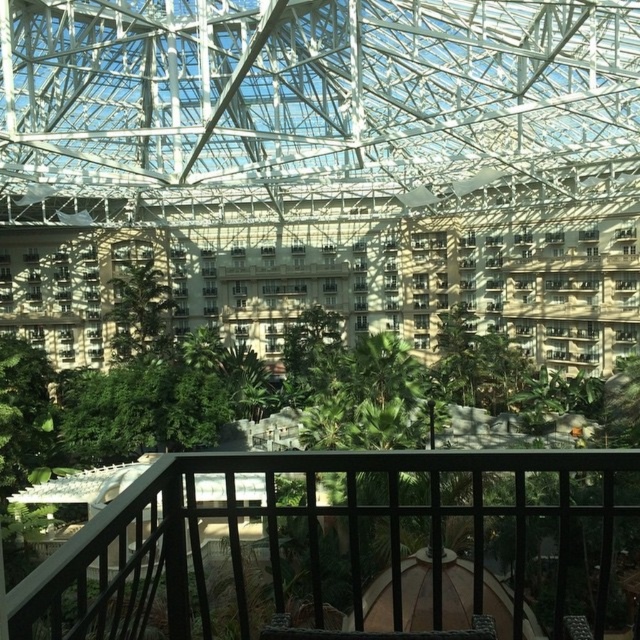
Looking at this image, you are standing in the atrium and want to look up at the glass roof structure. Is the black wood railing at center blocking your view of the beige concrete building at center?

The black wood railing at center is positioned under the beige concrete building at center, so the railing is below the building and would not block your view of the beige concrete building at center.

You are standing in the atrium and want to take a photo of the beige concrete building at center. If your camera can focus on objects up to 40 meters away, will you need to adjust your position to capture it clearly?

The beige concrete building at center is 41.51 meters away from viewer, which is beyond the camera focus range of 40 meters. You need to move closer to ensure clear focus.

In the scene shown: You are standing at the black railing in the foreground of the atrium. You notice the beige concrete building at center and the green leafy tree at center. Which object is positioned higher in the scene?

The beige concrete building at center is located above the green leafy tree at center, so it is positioned higher in the scene.